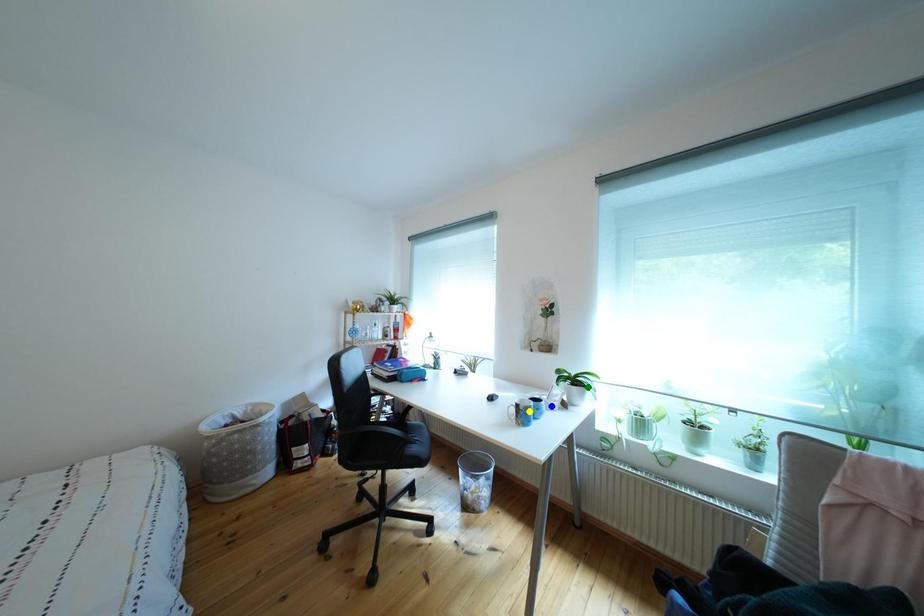
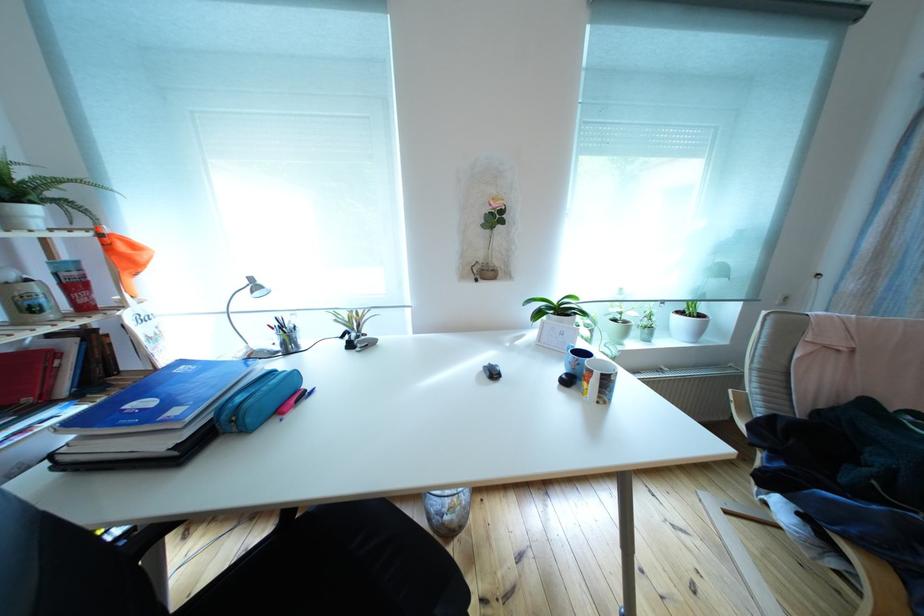
I am providing you with two images of the same scene from different viewpoints. Three points are marked in image1. Which point corresponds to a part or object that is occluded in image2?In image1, three points are marked. Which of them correspond to a part or object that is occluded in image2?Among the three points shown in image1, which one corresponds to a part or object that is no longer visible due to occlusion in image2?

blue point cannot be seen in image2.